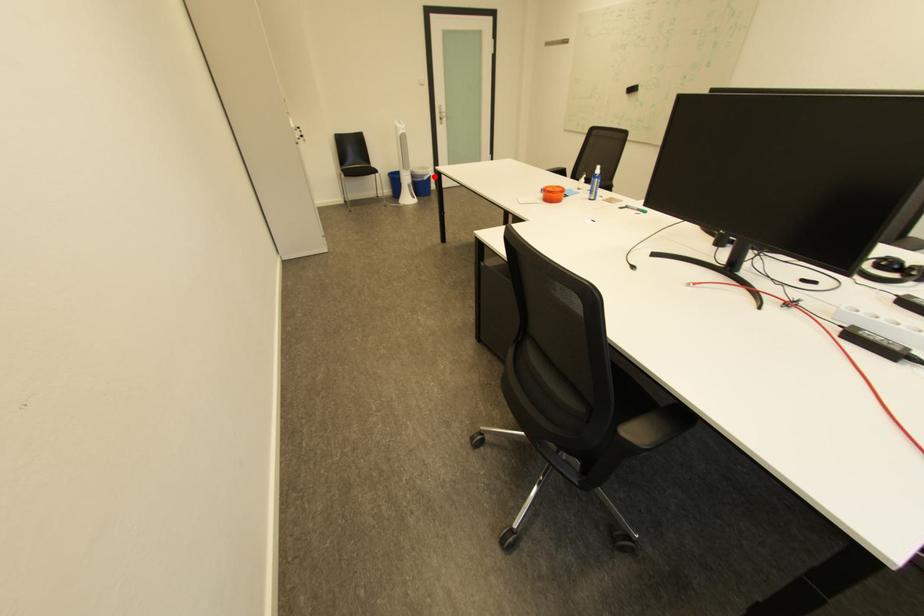
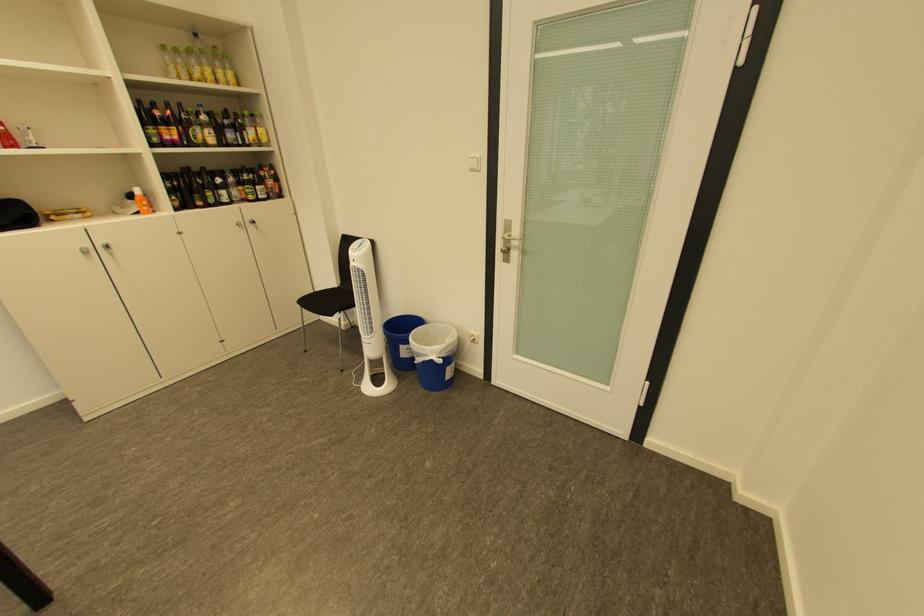
Locate, in the second image, the point that corresponds to the highlighted location in the first image.

(429, 355)